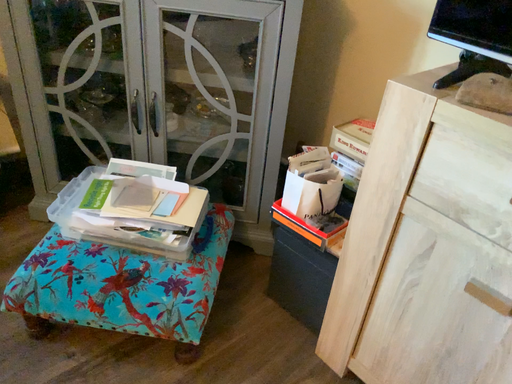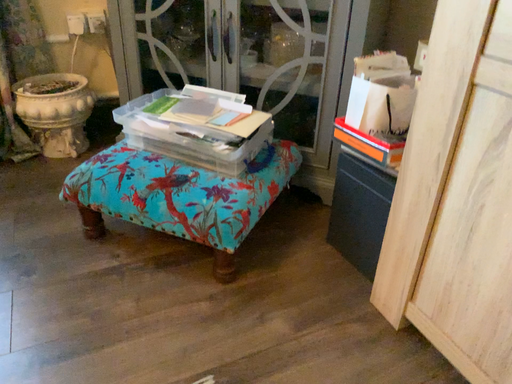
Question: How did the camera likely rotate when shooting the video?

Choices:
 (A) rotated left
 (B) rotated right

Answer: (A)